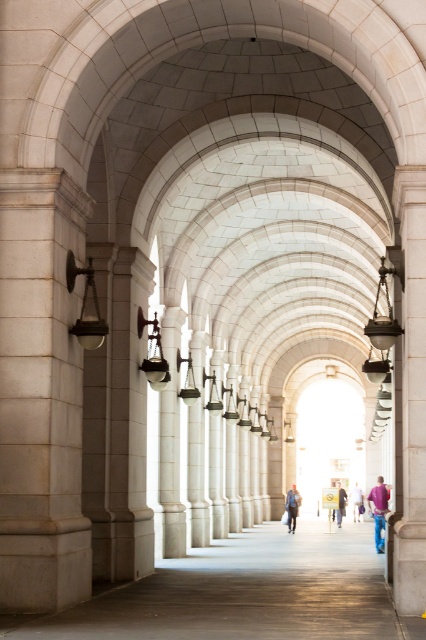
You are standing in the corridor and want to hang a new picture frame between the matte glass lamp at left and the blue denim jacket at center. Is there enough space between them for the frame?

The matte glass lamp at left is to the left of blue denim jacket at center, so there is space between them to hang the new picture frame.